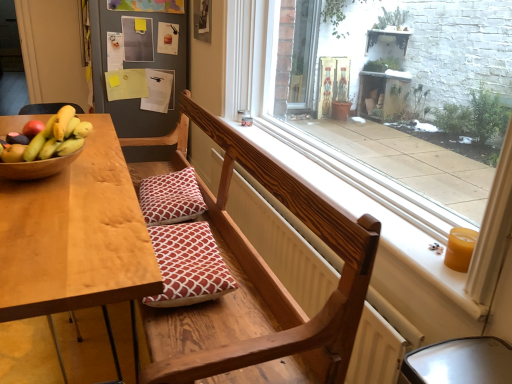
Question: From the image's perspective, does red cotton pillow at center, the first pillow from the bottom, appear lower than wooden table at left?

Choices:
 (A) no
 (B) yes

Answer: (A)

Question: Is red cotton pillow at center, acting as the 1th pillow starting from the front, facing away from wooden table at left?

Choices:
 (A) yes
 (B) no

Answer: (B)

Question: Does red cotton pillow at center, positioned as the 2th pillow in back-to-front order, lie in front of wooden table at left?

Choices:
 (A) no
 (B) yes

Answer: (A)

Question: Is red cotton pillow at center, positioned as the 2th pillow in back-to-front order, not inside wooden table at left?

Choices:
 (A) yes
 (B) no

Answer: (A)

Question: Is the depth of red cotton pillow at center, positioned as the 2th pillow in back-to-front order, greater than that of wooden table at left?

Choices:
 (A) yes
 (B) no

Answer: (A)

Question: Does red cotton pillow at center, marked as the second pillow in a top-to-bottom arrangement, turn towards wooden table at left?

Choices:
 (A) yes
 (B) no

Answer: (A)

Question: Would you consider shiny yellow bananas at table left to be distant from wooden bench at center?

Choices:
 (A) no
 (B) yes

Answer: (A)

Question: Considering the relative sizes of shiny yellow bananas at table left and wooden bench at center in the image provided, is shiny yellow bananas at table left shorter than wooden bench at center?

Choices:
 (A) yes
 (B) no

Answer: (A)

Question: Is shiny yellow bananas at table left located outside wooden bench at center?

Choices:
 (A) no
 (B) yes

Answer: (B)

Question: Is wooden bench at center surrounded by shiny yellow bananas at table left?

Choices:
 (A) no
 (B) yes

Answer: (A)

Question: Is shiny yellow bananas at table left at the right side of wooden bench at center?

Choices:
 (A) yes
 (B) no

Answer: (B)

Question: From a real-world perspective, is shiny yellow bananas at table left located higher than wooden bench at center?

Choices:
 (A) no
 (B) yes

Answer: (B)

Question: Does transparent glass window at center turn towards wooden bench at center?

Choices:
 (A) no
 (B) yes

Answer: (A)